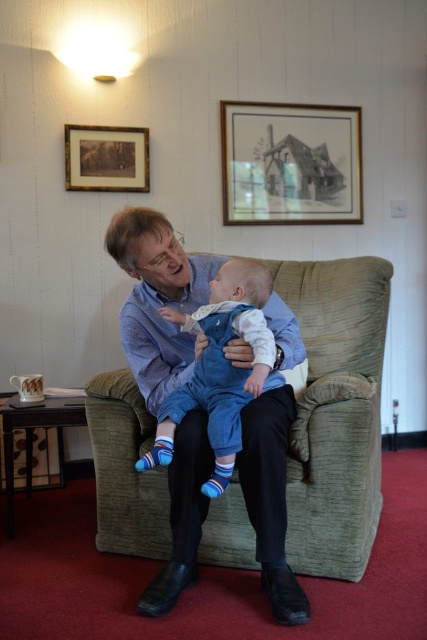
You are a painter standing in the living room. You want to paint the wooden picture frame at upper left but need to step back 5 feet to get a good perspective. If you are currently standing at the matte blue shirt at center, do you have enough space to move back 5 feet?

The distance between the matte blue shirt at center and the wooden picture frame at upper left is 4.58 feet. Since you need to step back 5 feet, you do not have enough space to move back the required distance.